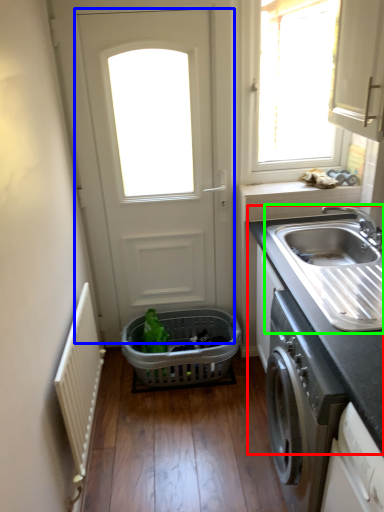
Question: Which object is positioned farthest from countertop (highlighted by a red box)? Select from door (highlighted by a blue box) and sink (highlighted by a green box).

Choices:
 (A) door
 (B) sink

Answer: (A)